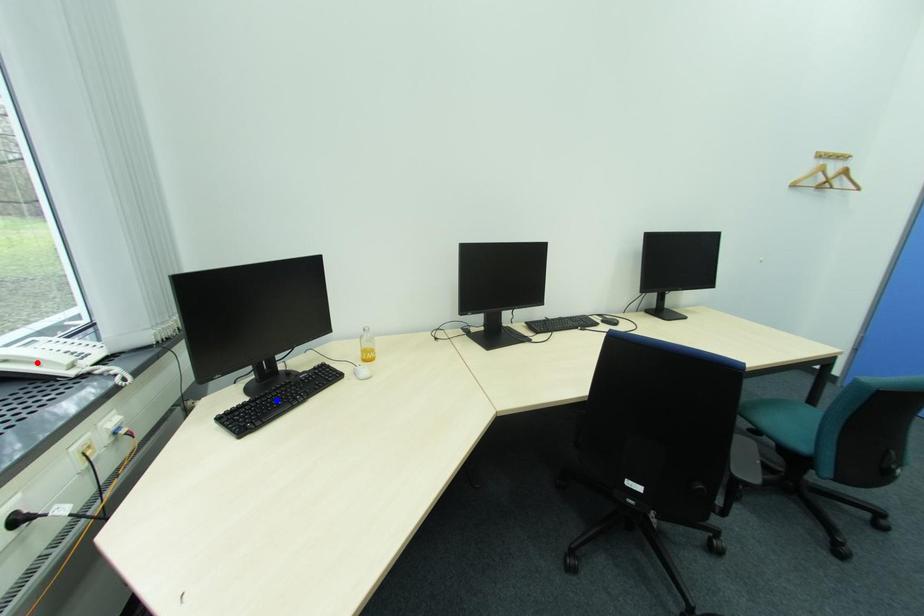
Question: In the image, two points are highlighted. Which point is nearer to the camera? Reply with the corresponding letter.

Choices:
 (A) blue point
 (B) red point

Answer: (A)